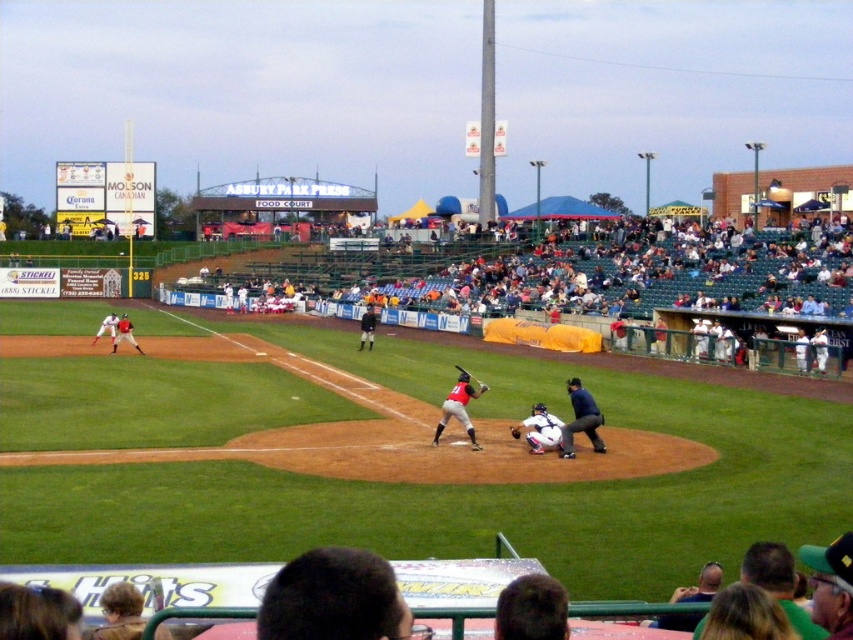
You are a baseball coach observing the game and need to determine which object is taller between the matte red baseball bat at center and the dark brown leather glove at center. Based on the scene, which one is taller?

The matte red baseball bat at center is taller than the dark brown leather glove at center according to the description.

You are a photographer standing at the edge of the field. You want to take a photo of the matte red baseball glove at left and the matte white uniform at left. Which object should you focus on first if you want to capture both in the same frame without moving the camera?

The matte red baseball glove at left is taller than the matte white uniform at left, so you should focus on the matte red baseball glove at left first to ensure it fits within the frame.